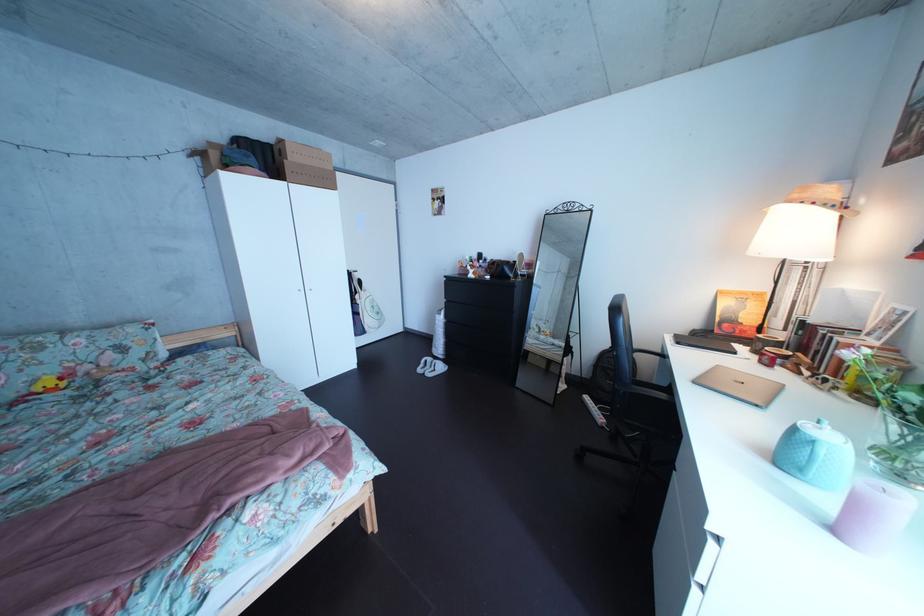
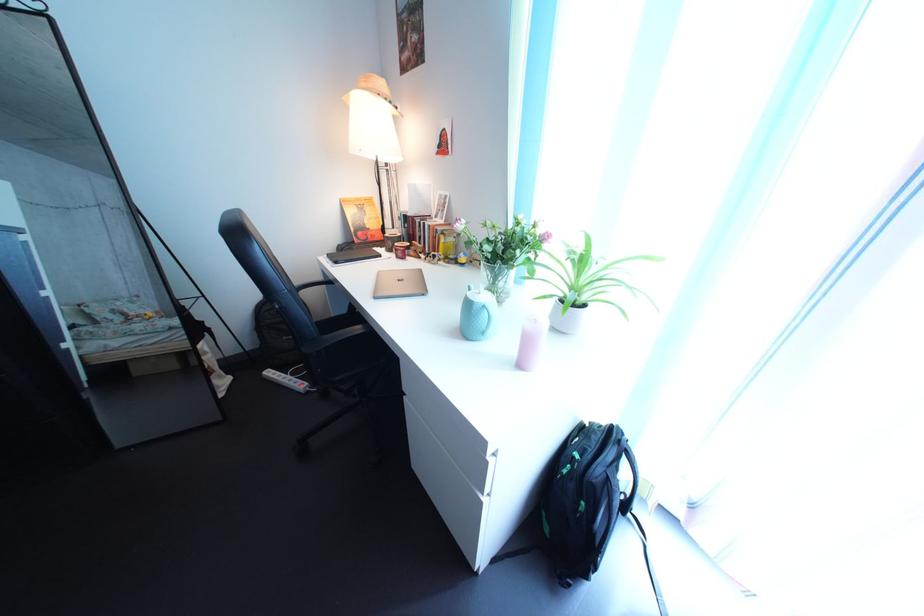
Locate, in the second image, the point that corresponds to (x=809, y=204) in the first image.

(378, 92)